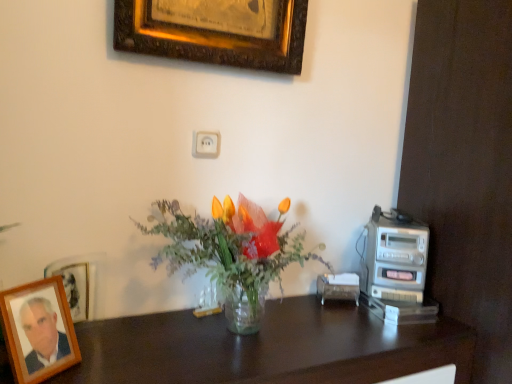
You are a GUI agent. You are given a task and a screenshot of the screen. Output one action in this format:
    pyautogui.click(x=<x>, y=<y>)
    Task: Click on the vacant region above silver metallic stereo at right (from a real-world perspective)
    Image resolution: width=512 pixels, height=384 pixels.
    Given the screenshot: What is the action you would take?
    pyautogui.click(x=403, y=223)